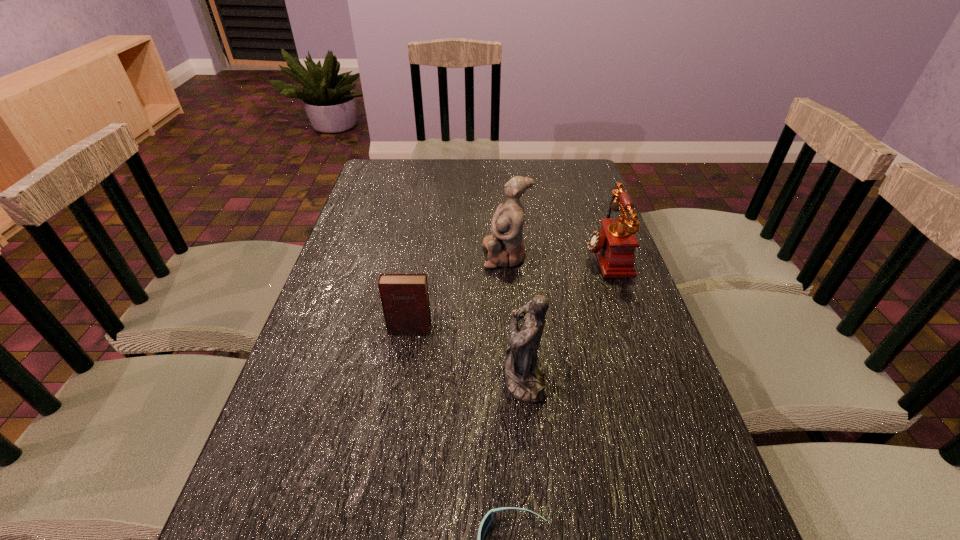
Find the location of a particular element. The height and width of the screenshot is (540, 960). vacant space at the far right corner of the desktop is located at coordinates (564, 182).

At what (x,y) coordinates should I click in order to perform the action: click on empty space between the diary and the nearer figurine. Please return your answer as a coordinate pair (x, y). Image resolution: width=960 pixels, height=540 pixels. Looking at the image, I should click on (467, 353).

Find the location of a particular element. This screenshot has height=540, width=960. free space that is in between the farther figurine and the telephone is located at coordinates (555, 255).

Locate an element on the screen. The image size is (960, 540). free space between the leftmost object and the rightmost object is located at coordinates (507, 292).

Locate an element on the screen. free space between the third nearest object and the farther figurine is located at coordinates (458, 292).

Locate which object is the second closest to the shortest object. Please provide its 2D coordinates. Your answer should be formatted as a tuple, i.e. [(x, y)], where the tuple contains the x and y coordinates of a point satisfying the conditions above.

[(405, 300)]

I want to click on object identified as the closest to the fourth tallest object, so click(x=524, y=370).

Find the location of a particular element. The image size is (960, 540). free spot that satisfies the following two spatial constraints: 1. on the front-facing side of the farther figurine; 2. on the front cover of the third farthest object is located at coordinates (511, 329).